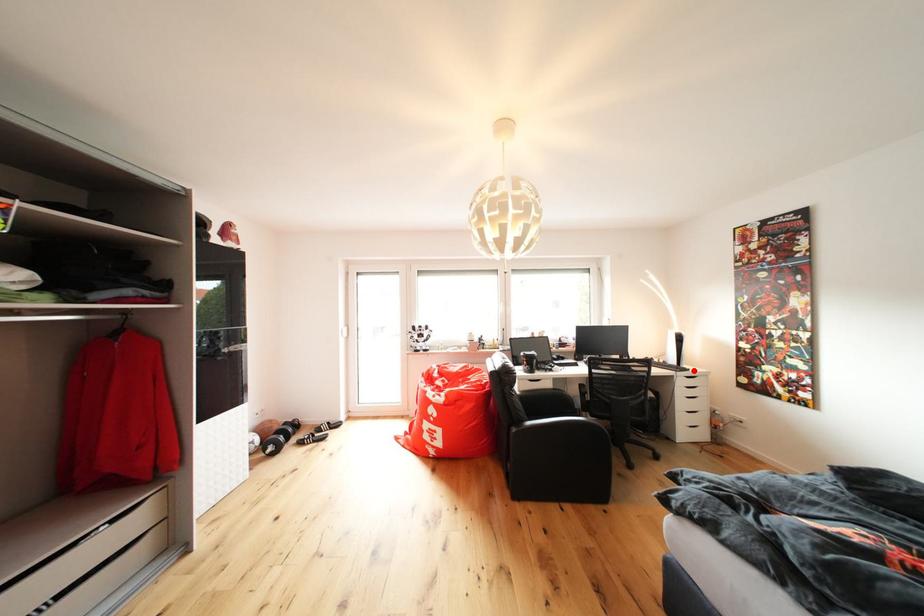
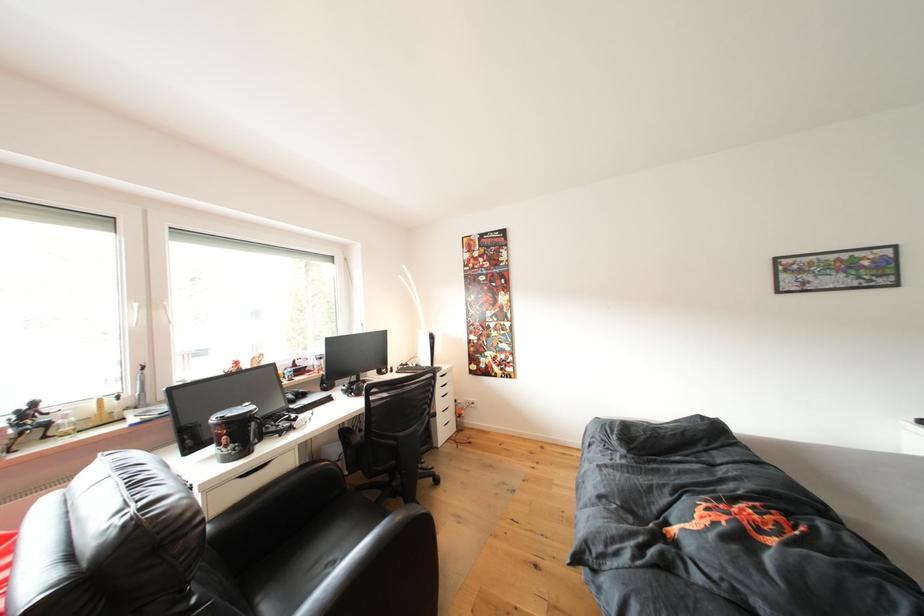
Question: I am providing you with two images of the same scene from different viewpoints. A red point is shown in image1. For the corresponding object point in image2, is it positioned nearer or farther from the camera?

Choices:
 (A) Nearer
 (B) Farther

Answer: (B)